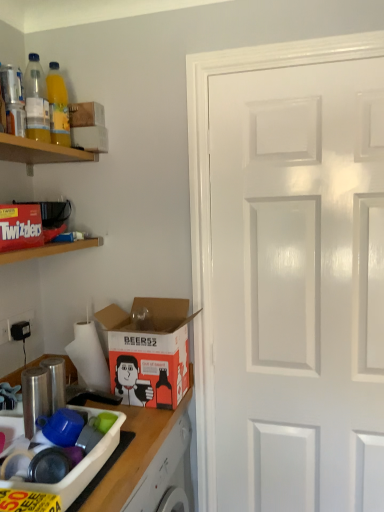
Question: Can you confirm if orange matte cardboard box at lower left is shorter than white cardboard box at upper left, which ranks as the first box in back-to-front order?

Choices:
 (A) no
 (B) yes

Answer: (A)

Question: From a real-world perspective, is orange matte cardboard box at lower left located beneath white cardboard box at upper left, which ranks as the first box in back-to-front order?

Choices:
 (A) no
 (B) yes

Answer: (B)

Question: Is orange matte cardboard box at lower left positioned beyond the bounds of white cardboard box at upper left, which appears as the first box when viewed from the top?

Choices:
 (A) no
 (B) yes

Answer: (B)

Question: Can white cardboard box at upper left, which ranks as the first box in back-to-front order, be found inside orange matte cardboard box at lower left?

Choices:
 (A) no
 (B) yes

Answer: (A)

Question: Considering the relative sizes of orange matte cardboard box at lower left and white cardboard box at upper left, which ranks as the first box in back-to-front order, in the image provided, is orange matte cardboard box at lower left smaller than white cardboard box at upper left, which ranks as the first box in back-to-front order,?

Choices:
 (A) no
 (B) yes

Answer: (A)

Question: Considering the positions of wooden countertop at lower left and wooden shelf at upper left, arranged as the second shelf when ordered from the bottom, in the image, is wooden countertop at lower left taller or shorter than wooden shelf at upper left, arranged as the second shelf when ordered from the bottom,?

Choices:
 (A) short
 (B) tall

Answer: (B)

Question: From the image's perspective, is wooden countertop at lower left located above or below wooden shelf at upper left, arranged as the second shelf when ordered from the bottom?

Choices:
 (A) below
 (B) above

Answer: (A)

Question: From a real-world perspective, is wooden countertop at lower left physically located above or below wooden shelf at upper left, arranged as the second shelf when ordered from the bottom?

Choices:
 (A) below
 (B) above

Answer: (A)

Question: Is wooden countertop at lower left to the left or to the right of wooden shelf at upper left, arranged as the second shelf when ordered from the bottom, in the image?

Choices:
 (A) right
 (B) left

Answer: (A)

Question: From a real-world perspective, is red matte twizzlers box at upper left, arranged as the first shelf when ordered from the bottom, physically located above or below matte red twizzlers box at upper left, marked as the second box in a back-to-front arrangement?

Choices:
 (A) above
 (B) below

Answer: (B)

Question: Relative to matte red twizzlers box at upper left, marked as the second box in a back-to-front arrangement, is red matte twizzlers box at upper left, marked as the second shelf in a top-to-bottom arrangement, in front or behind?

Choices:
 (A) front
 (B) behind

Answer: (A)

Question: Is red matte twizzlers box at upper left, arranged as the first shelf when ordered from the bottom, inside or outside of matte red twizzlers box at upper left, marked as the second box in a top-to-bottom arrangement?

Choices:
 (A) outside
 (B) inside

Answer: (A)

Question: Considering the positions of point (29, 251) and point (8, 239), is point (29, 251) closer or farther from the camera than point (8, 239)?

Choices:
 (A) farther
 (B) closer

Answer: (A)

Question: Considering the positions of red matte twizzlers box at upper left, marked as the second shelf in a top-to-bottom arrangement, and white matte toilet paper at lower left in the image, is red matte twizzlers box at upper left, marked as the second shelf in a top-to-bottom arrangement, wider or thinner than white matte toilet paper at lower left?

Choices:
 (A) thin
 (B) wide

Answer: (B)

Question: Relative to white matte toilet paper at lower left, is red matte twizzlers box at upper left, arranged as the first shelf when ordered from the bottom, in front or behind?

Choices:
 (A) behind
 (B) front

Answer: (B)